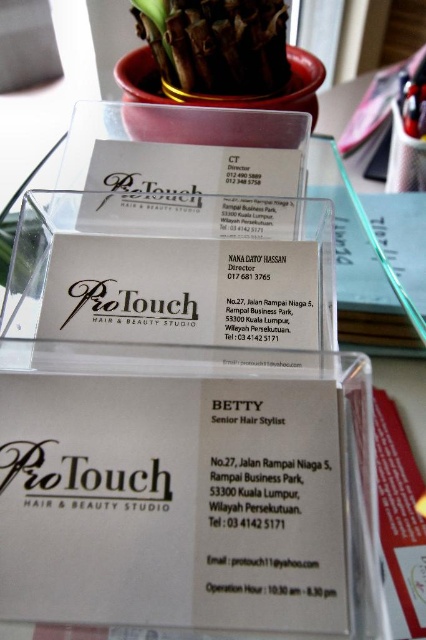
Question: Can you confirm if white paper business card at center is positioned below brown textured plant at upper center?

Choices:
 (A) no
 (B) yes

Answer: (B)

Question: In this image, where is white paper business card at center located relative to matte gold card at center?

Choices:
 (A) right
 (B) left

Answer: (B)

Question: Which point appears farthest from the camera in this image?

Choices:
 (A) (172, 332)
 (B) (198, 44)
 (C) (195, 390)

Answer: (B)

Question: Which object is positioned farthest from the matte gold card at center?

Choices:
 (A) matte white card at center
 (B) brown textured plant at upper center
 (C) white paper business card at center

Answer: (B)

Question: Which point is farther to the camera?

Choices:
 (A) brown textured plant at upper center
 (B) matte white card at center
 (C) matte gold card at center

Answer: (A)

Question: Can you confirm if matte white card at center is positioned above brown textured plant at upper center?

Choices:
 (A) no
 (B) yes

Answer: (A)